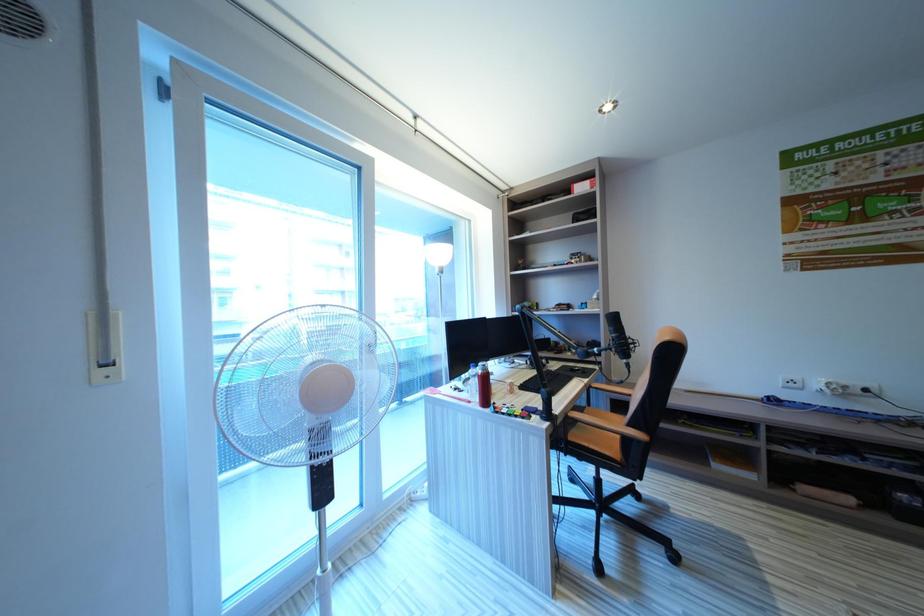
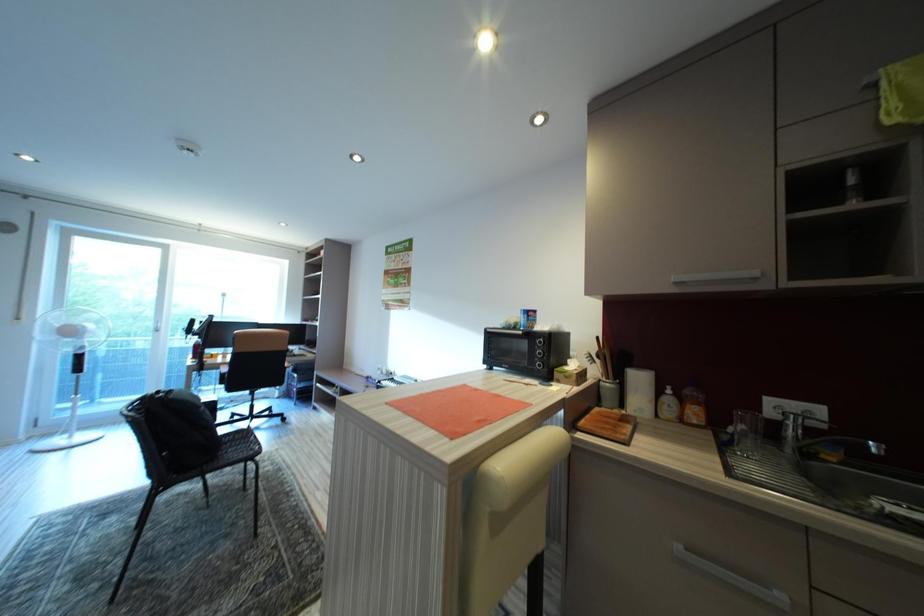
Which direction would the cameraman need to move to produce the second image?

The cameraman moved toward right, backward.